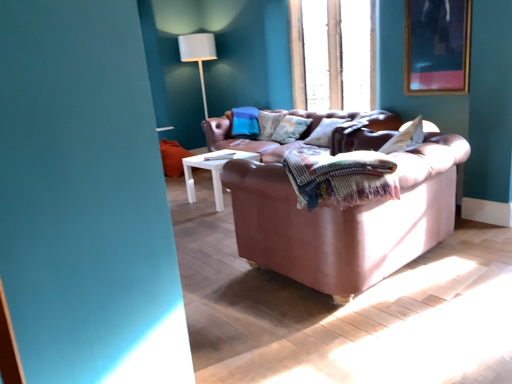
Question: From a real-world perspective, is wooden at upper center physically above wooden-framed artwork at upper right?

Choices:
 (A) no
 (B) yes

Answer: (B)

Question: Considering the relative sizes of wooden at upper center and wooden-framed artwork at upper right in the image provided, is wooden at upper center thinner than wooden-framed artwork at upper right?

Choices:
 (A) no
 (B) yes

Answer: (A)

Question: Is wooden at upper center with wooden-framed artwork at upper right?

Choices:
 (A) no
 (B) yes

Answer: (A)

Question: Is wooden at upper center bigger than wooden-framed artwork at upper right?

Choices:
 (A) no
 (B) yes

Answer: (B)

Question: Does wooden at upper center have a lesser height compared to wooden-framed artwork at upper right?

Choices:
 (A) no
 (B) yes

Answer: (A)

Question: From a real-world perspective, is white fabric lampshade at upper center physically located above or below leather couch at center?

Choices:
 (A) below
 (B) above

Answer: (B)

Question: In terms of width, does white fabric lampshade at upper center look wider or thinner when compared to leather couch at center?

Choices:
 (A) thin
 (B) wide

Answer: (A)

Question: Does point (196, 49) appear closer or farther from the camera than point (382, 132)?

Choices:
 (A) farther
 (B) closer

Answer: (A)

Question: Considering the positions of white fabric lampshade at upper center and leather couch at center in the image, is white fabric lampshade at upper center taller or shorter than leather couch at center?

Choices:
 (A) tall
 (B) short

Answer: (A)

Question: Visually, is woven multicolored blanket at center positioned to the left or to the right of leather couch at center?

Choices:
 (A) left
 (B) right

Answer: (A)

Question: Considering their positions, is woven multicolored blanket at center located in front of or behind leather couch at center?

Choices:
 (A) front
 (B) behind

Answer: (A)

Question: From a real-world perspective, is woven multicolored blanket at center physically located above or below leather couch at center?

Choices:
 (A) above
 (B) below

Answer: (A)

Question: Considering the positions of woven multicolored blanket at center and leather couch at center in the image, is woven multicolored blanket at center wider or thinner than leather couch at center?

Choices:
 (A) wide
 (B) thin

Answer: (B)

Question: Relative to woven multicolored blanket at center, is wooden-framed artwork at upper right in front or behind?

Choices:
 (A) behind
 (B) front

Answer: (A)

Question: Considering the positions of wooden-framed artwork at upper right and woven multicolored blanket at center in the image, is wooden-framed artwork at upper right wider or thinner than woven multicolored blanket at center?

Choices:
 (A) thin
 (B) wide

Answer: (A)